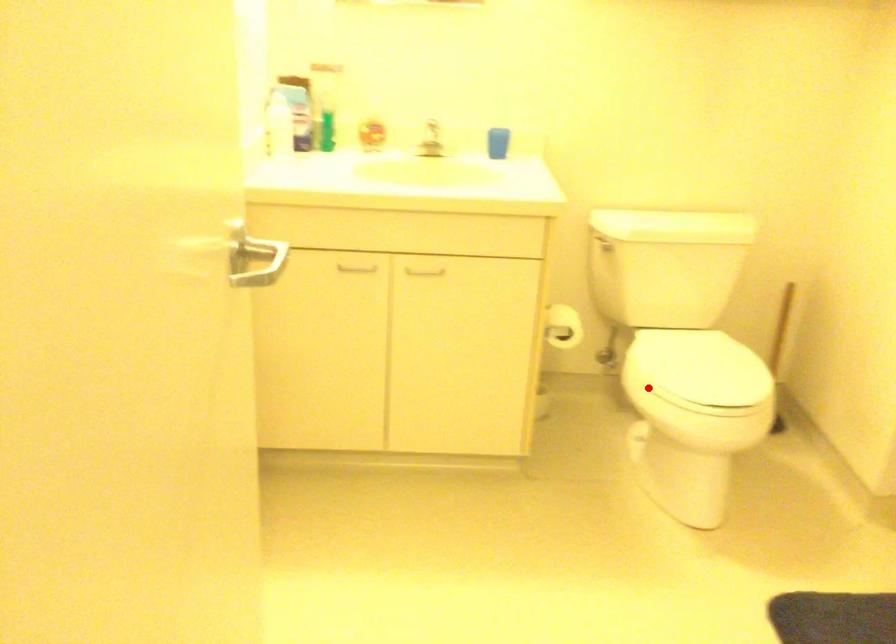
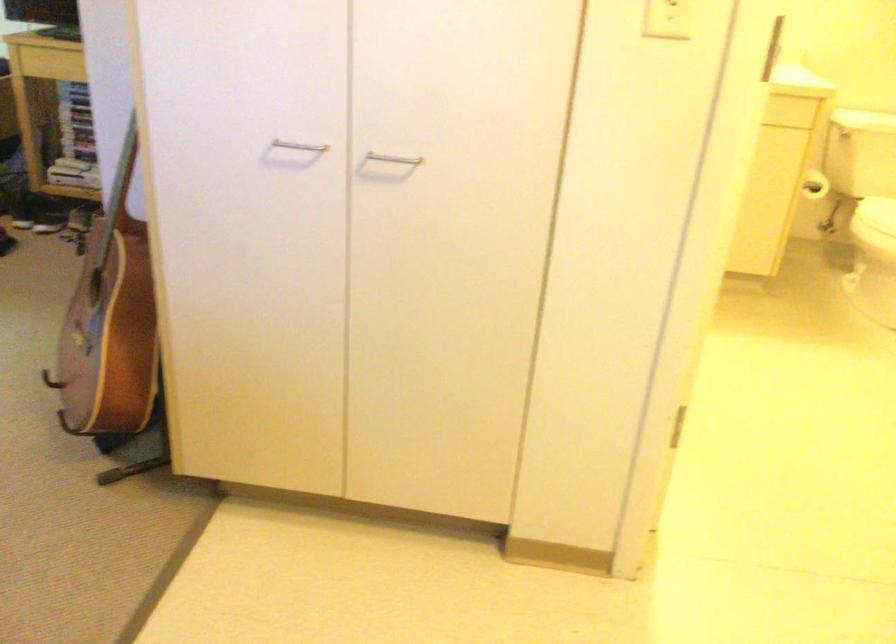
Question: I am providing you with two images of the same scene from different viewpoints. A red point is shown in image1. For the corresponding object point in image2, is it positioned nearer or farther from the camera?

Choices:
 (A) Nearer
 (B) Farther

Answer: (B)